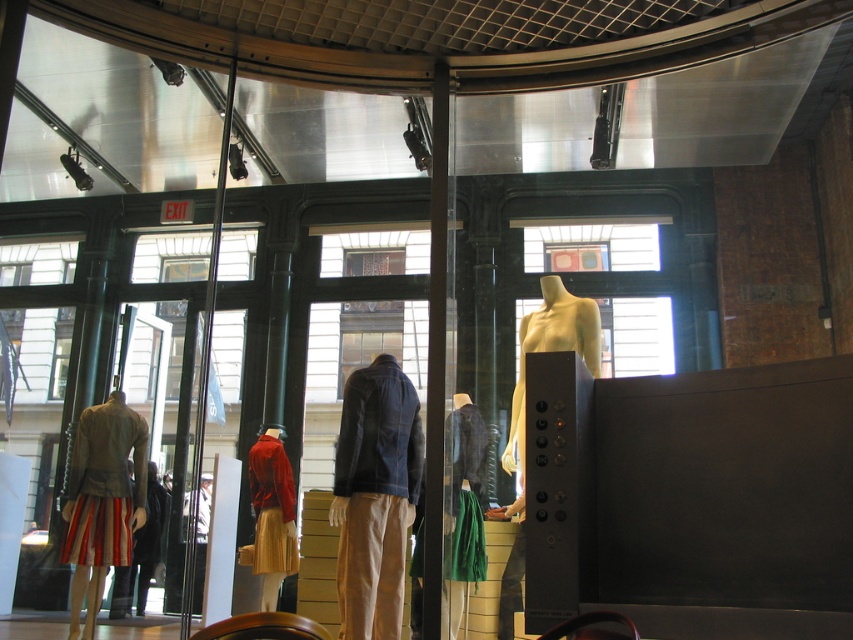
You are a store employee organizing a display. You need to place a new accessory shelf between the striped cotton skirt at lower left and the shiny red jacket at center. Based on their widths, will the shelf fit if it requires at least 1.2 meters of space?

The striped cotton skirt at lower left might be wider than shiny red jacket at center, but without exact measurements, it is uncertain if the total width between them meets the 1.2 meters requirement. Check the actual space before placing the shelf.

You are a store employee who needs to move a 40 cm wide box from the backroom to the display area. The path between the green fabric skirt at center and the matte yellow mannequin at center is your only route. Can you safely transport the box through this path without hitting either object?

The distance between the green fabric skirt at center and the matte yellow mannequin at center is 50.11 centimeters, which is wider than the 40 cm box. Therefore, you can safely transport the box through the path between them.